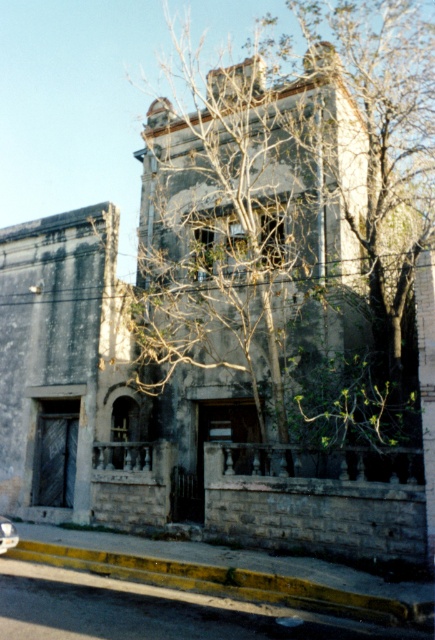
Who is positioned more to the right, bare branches at center or yellow painted concrete curb at lower center?

From the viewer's perspective, bare branches at center appears more on the right side.

Where is `bare branches at center`? This screenshot has height=640, width=435. bare branches at center is located at coordinates (290, 232).